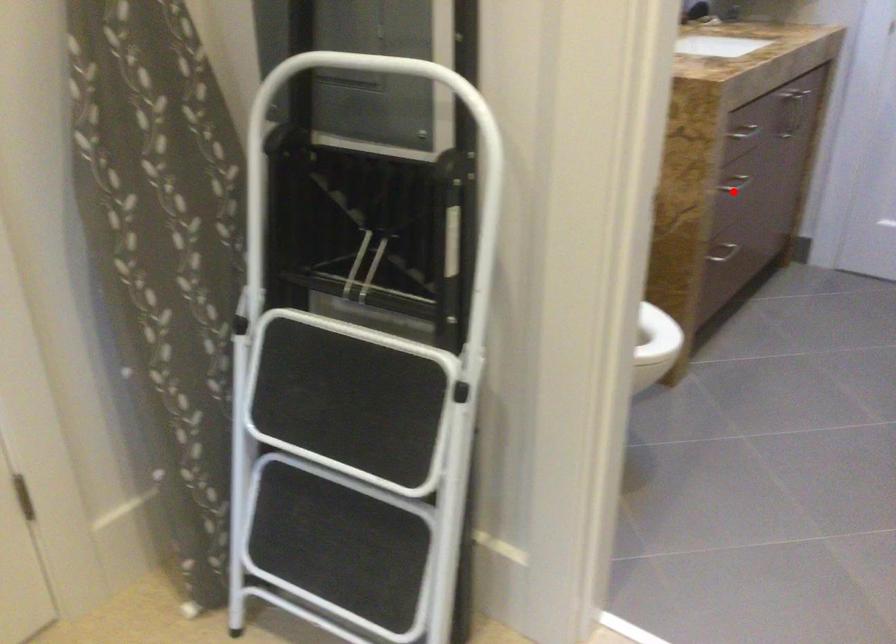
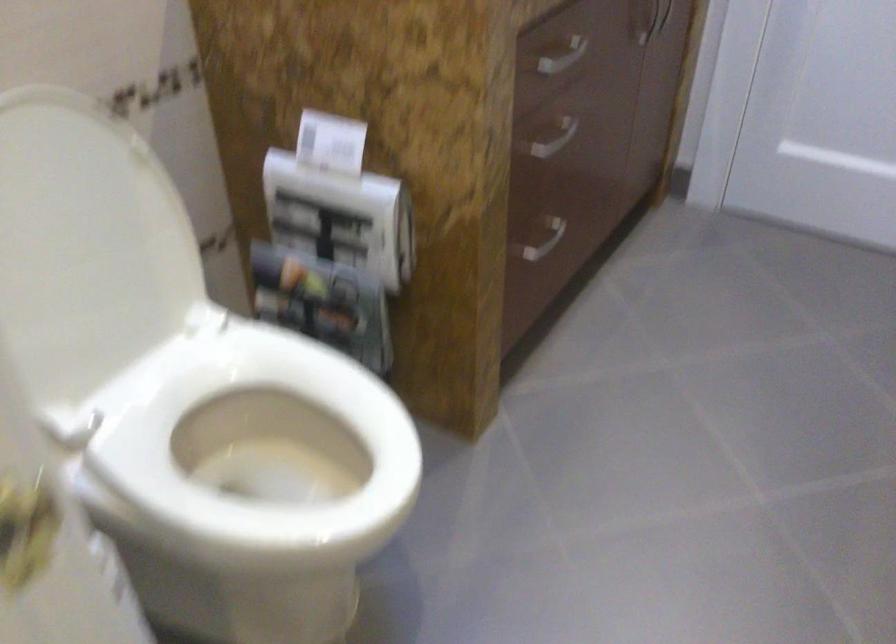
Where in the second image is the point corresponding to the highlighted location from the first image?

(554, 138)